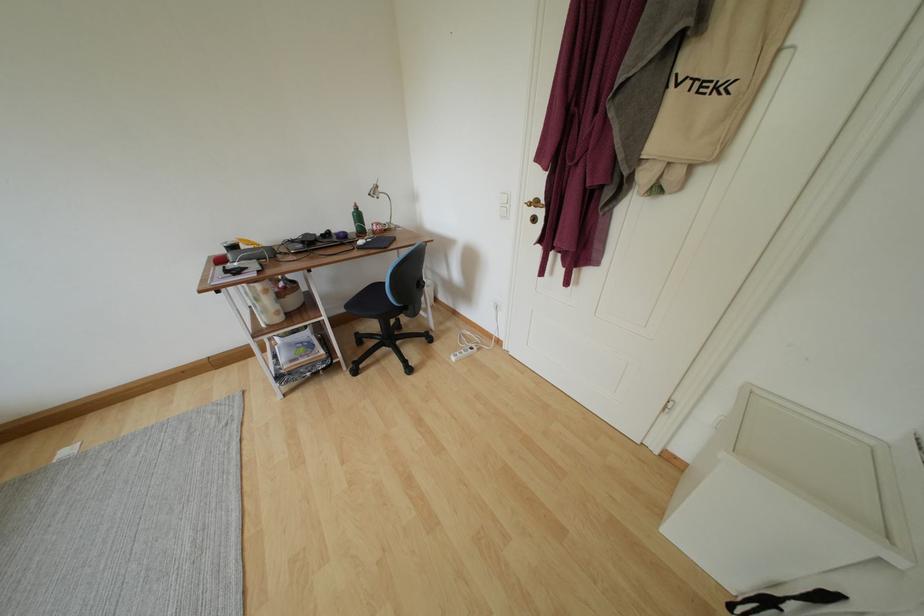
Where would you open the white cabinet lid? Please return your answer as a coordinate pair (x, y).

(815, 463)